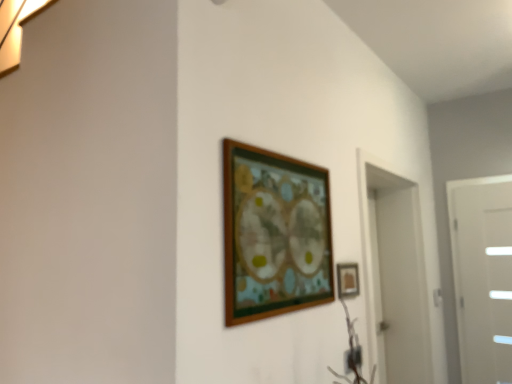
Question: From a real-world perspective, is wooden picture frame at center, which appears as the second picture frame when viewed from the back, positioned under white glossy door at right based on gravity?

Choices:
 (A) yes
 (B) no

Answer: (B)

Question: Is wooden picture frame at center, marked as the second picture frame in a right-to-left arrangement, smaller than white glossy door at right?

Choices:
 (A) yes
 (B) no

Answer: (A)

Question: Is wooden picture frame at center, which appears as the second picture frame when viewed from the back, thinner than white glossy door at right?

Choices:
 (A) no
 (B) yes

Answer: (B)

Question: Is wooden picture frame at center, which appears as the first picture frame when viewed from the front, positioned in front of white glossy door at right?

Choices:
 (A) yes
 (B) no

Answer: (A)

Question: Is wooden picture frame at center, which appears as the second picture frame when viewed from the back, oriented towards white glossy door at right?

Choices:
 (A) no
 (B) yes

Answer: (A)

Question: In the image, is white glossy door at right positioned in front of or behind wooden picture frame at center, which appears as the first picture frame when viewed from the front?

Choices:
 (A) front
 (B) behind

Answer: (B)

Question: Is point (507, 354) closer or farther from the camera than point (236, 284)?

Choices:
 (A) farther
 (B) closer

Answer: (A)

Question: From a real-world perspective, is white glossy door at right positioned above or below wooden picture frame at center, which appears as the first picture frame when viewed from the front?

Choices:
 (A) below
 (B) above

Answer: (A)

Question: Is white glossy door at right wider or thinner than wooden picture frame at center, the 1th picture frame in the left-to-right sequence?

Choices:
 (A) thin
 (B) wide

Answer: (B)

Question: Based on their sizes in the image, would you say matte gold picture frame at center-right, positioned as the 1th picture frame in back-to-front order, is bigger or smaller than white glossy door at right?

Choices:
 (A) big
 (B) small

Answer: (B)

Question: Is matte gold picture frame at center-right, positioned as the 1th picture frame in back-to-front order, taller or shorter than white glossy door at right?

Choices:
 (A) short
 (B) tall

Answer: (A)

Question: Is matte gold picture frame at center-right, positioned as the 1th picture frame in back-to-front order, spatially inside white glossy door at right, or outside of it?

Choices:
 (A) inside
 (B) outside

Answer: (B)

Question: From the image's perspective, relative to white glossy door at right, is matte gold picture frame at center-right, marked as the second picture frame in a front-to-back arrangement, above or below?

Choices:
 (A) below
 (B) above

Answer: (B)

Question: Is wooden picture frame at center, marked as the second picture frame in a right-to-left arrangement, wider or thinner than white glossy door at right?

Choices:
 (A) thin
 (B) wide

Answer: (A)

Question: Visually, is wooden picture frame at center, the 1th picture frame in the left-to-right sequence, positioned to the left or to the right of white glossy door at right?

Choices:
 (A) right
 (B) left

Answer: (B)